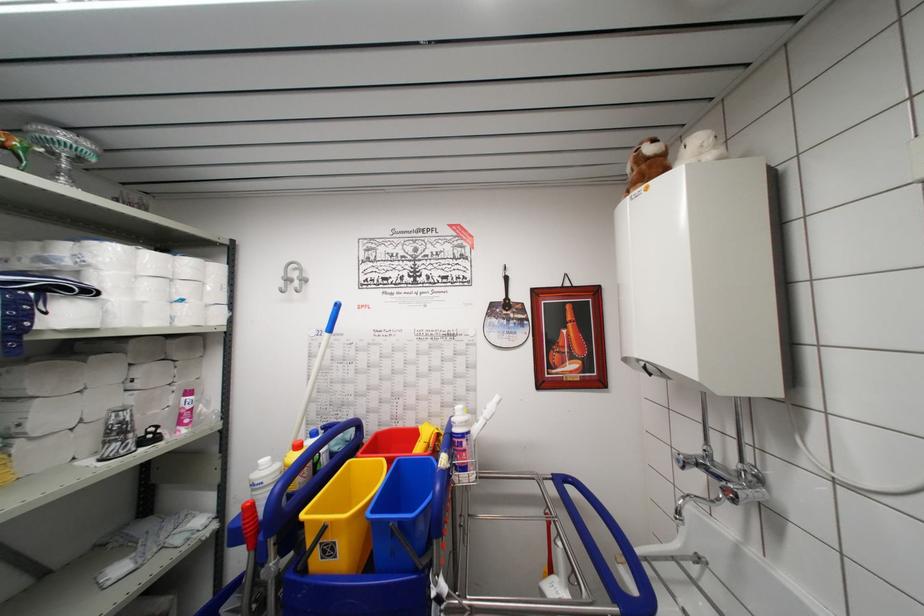
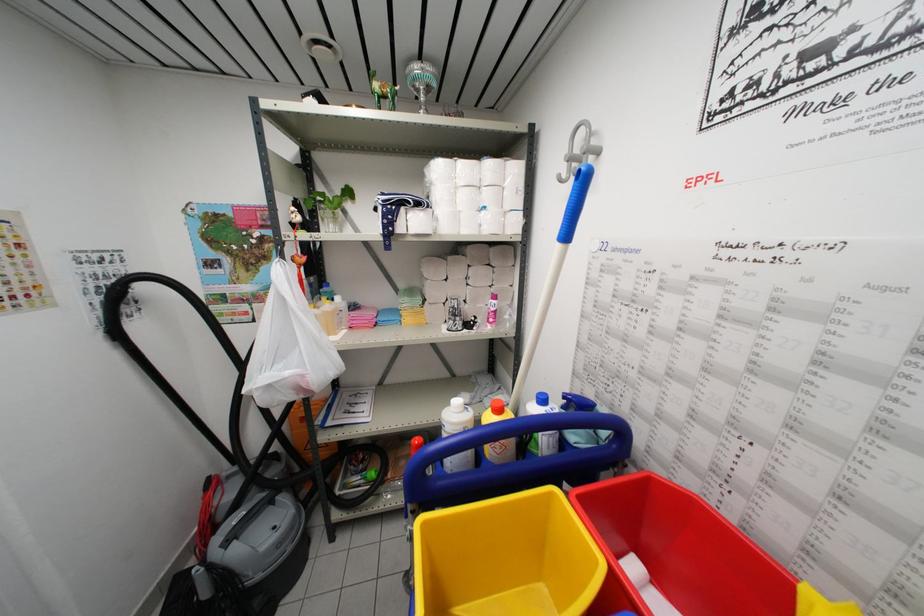
The point at (353, 468) is marked in the first image. Where is the corresponding point in the second image?

(554, 498)